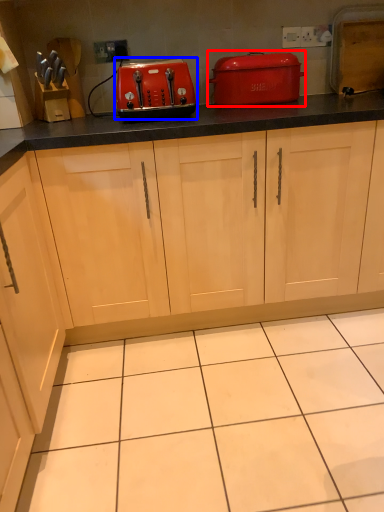
Question: Among these objects, which one is nearest to the camera, home appliance (highlighted by a red box) or kitchen appliance (highlighted by a blue box)?

Choices:
 (A) home appliance
 (B) kitchen appliance

Answer: (B)